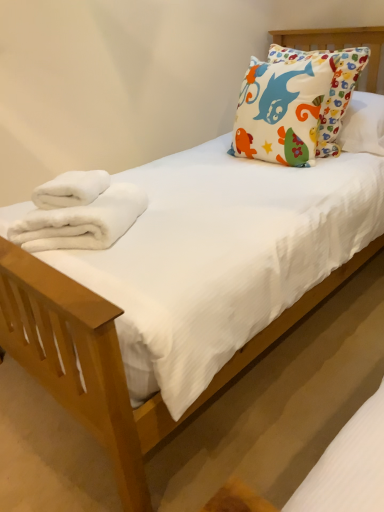
Question: Is the depth of white fluffy towel at left, the 1th bath towel in the top-to-bottom sequence, greater than that of multicolored fabric pillow at upper right?

Choices:
 (A) no
 (B) yes

Answer: (A)

Question: From the image's perspective, is white fluffy towel at left, which is the second bath towel in bottom-to-top order, above multicolored fabric pillow at upper right?

Choices:
 (A) no
 (B) yes

Answer: (A)

Question: Can you confirm if white fluffy towel at left, which is the second bath towel in bottom-to-top order, is shorter than multicolored fabric pillow at upper right?

Choices:
 (A) no
 (B) yes

Answer: (B)

Question: From a real-world perspective, is white fluffy towel at left, the 1th bath towel in the top-to-bottom sequence, physically above multicolored fabric pillow at upper right?

Choices:
 (A) yes
 (B) no

Answer: (B)

Question: Is white fluffy towel at left, which is the second bath towel in bottom-to-top order, to the right of multicolored fabric pillow at upper right from the viewer's perspective?

Choices:
 (A) no
 (B) yes

Answer: (A)

Question: Is white fluffy towel at left, which is the second bath towel in bottom-to-top order, facing away from multicolored fabric pillow at upper right?

Choices:
 (A) yes
 (B) no

Answer: (B)

Question: From the image's perspective, is white fluffy towel at left, which is the second bath towel in bottom-to-top order, on white fluffy towels at lower left, which appears as the second bath towel when viewed from the top?

Choices:
 (A) yes
 (B) no

Answer: (A)

Question: Are white fluffy towel at left, which is the second bath towel in bottom-to-top order, and white fluffy towels at lower left, the first bath towel ordered from the bottom, far apart?

Choices:
 (A) no
 (B) yes

Answer: (A)

Question: Is white fluffy towel at left, the 1th bath towel in the top-to-bottom sequence, next to white fluffy towels at lower left, which appears as the second bath towel when viewed from the top?

Choices:
 (A) yes
 (B) no

Answer: (A)

Question: From a real-world perspective, is white fluffy towel at left, which is the second bath towel in bottom-to-top order, below white fluffy towels at lower left, the first bath towel ordered from the bottom?

Choices:
 (A) no
 (B) yes

Answer: (A)

Question: Can you confirm if white fluffy towel at left, the 1th bath towel in the top-to-bottom sequence, is positioned to the right of white fluffy towels at lower left, the first bath towel ordered from the bottom?

Choices:
 (A) no
 (B) yes

Answer: (A)

Question: Can you confirm if white fluffy towel at left, which is the second bath towel in bottom-to-top order, is smaller than white fluffy towels at lower left, the first bath towel ordered from the bottom?

Choices:
 (A) yes
 (B) no

Answer: (A)

Question: Is white fluffy towels at lower left, the first bath towel ordered from the bottom, not within multicolored fabric pillow at upper right?

Choices:
 (A) no
 (B) yes

Answer: (B)